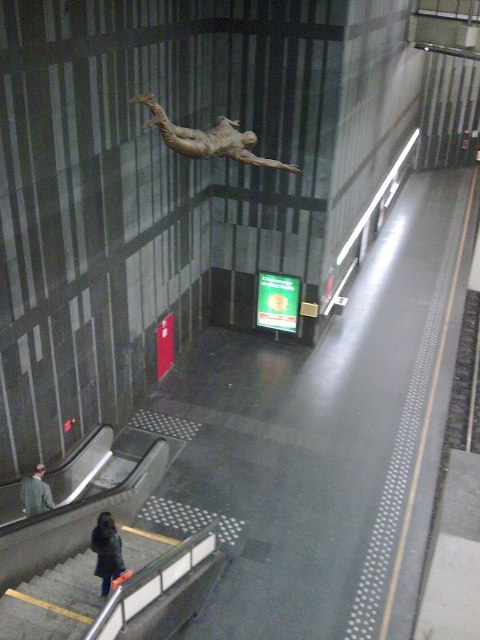
You are a maintenance worker in the subway station and need to reach the gray concrete stairs at lower left. You have a ladder that is 6 meters long. Will the ladder be long enough to reach the stairs from your current position?

The distance between you and the gray concrete stairs at lower left is 6.85 meters, so the ladder that is 6 meters long will not be long enough to reach the stairs from your current position.

Based on the photo, you are a traveler carrying a heavy backpack and need to descend to the lower level of the subway station. You see the gray concrete stairs at lower left and the gray wool coat at lower left. Which object is located lower in the scene?

The gray concrete stairs at lower left is below the gray wool coat at lower left, so the stairs are located lower than the coat.

You are a visitor at the subway station and want to take a photo of the bronze statue at upper center without the gray wool coat at lower left blocking the view. Is the statue tall enough to be seen over the coat?

The bronze statue at upper center is much taller than the gray wool coat at lower left, so yes, the statue can be seen over the coat.